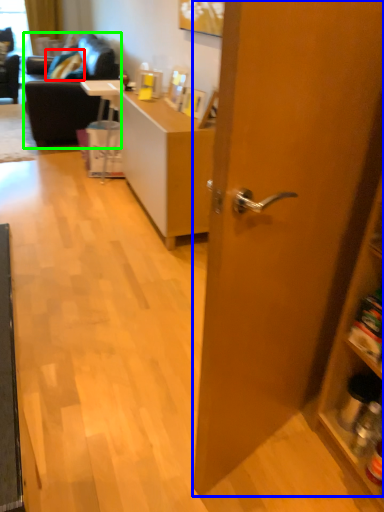
Question: Which object is positioned closest to pillow (highlighted by a red box)? Select from door (highlighted by a blue box) and studio couch (highlighted by a green box).

Choices:
 (A) door
 (B) studio couch

Answer: (B)